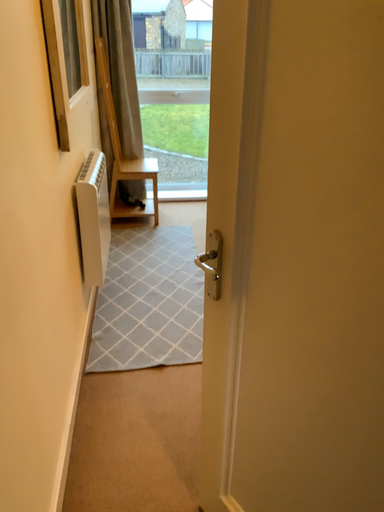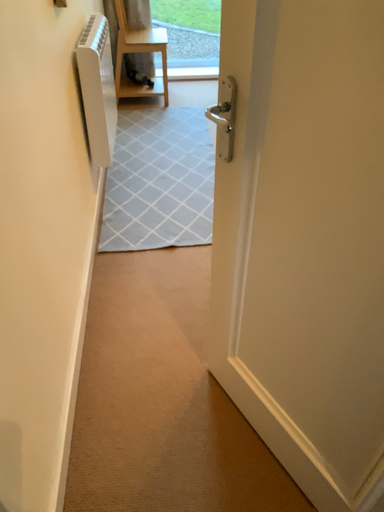
Question: Which way did the camera rotate in the video?

Choices:
 (A) rotated downward
 (B) rotated upward

Answer: (A)